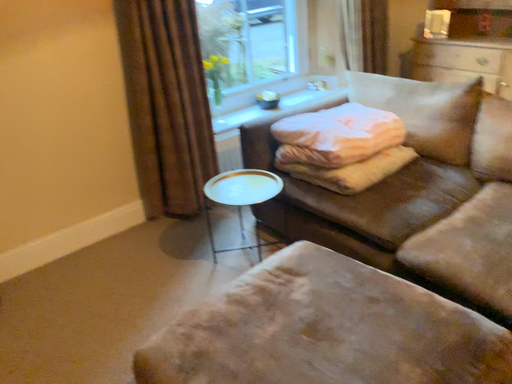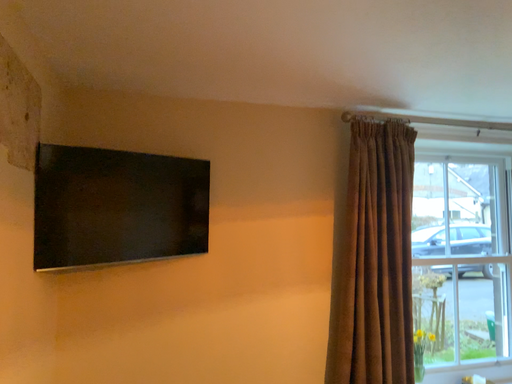
Question: How did the camera likely rotate when shooting the video?

Choices:
 (A) rotated right
 (B) rotated left

Answer: (B)